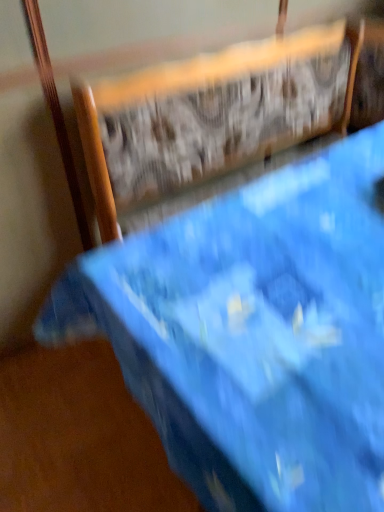
Question: Can you confirm if blue fabric chair at upper center is shorter than blue fabric bed at upper center?

Choices:
 (A) yes
 (B) no

Answer: (B)

Question: From the image's perspective, does blue fabric chair at upper center appear higher than blue fabric bed at upper center?

Choices:
 (A) yes
 (B) no

Answer: (A)

Question: Is the surface of blue fabric chair at upper center in direct contact with blue fabric bed at upper center?

Choices:
 (A) yes
 (B) no

Answer: (B)

Question: Does blue fabric chair at upper center appear on the right side of blue fabric bed at upper center?

Choices:
 (A) yes
 (B) no

Answer: (B)

Question: Is blue fabric chair at upper center facing towards blue fabric bed at upper center?

Choices:
 (A) no
 (B) yes

Answer: (B)

Question: Is blue fabric chair at upper center far away from blue fabric bed at upper center?

Choices:
 (A) yes
 (B) no

Answer: (B)

Question: From a real-world perspective, does blue fabric bed at upper center sit lower than blue fabric chair at upper center?

Choices:
 (A) no
 (B) yes

Answer: (A)

Question: From a real-world perspective, is blue fabric bed at upper center on blue fabric chair at upper center?

Choices:
 (A) yes
 (B) no

Answer: (A)

Question: From the image's perspective, is blue fabric bed at upper center above blue fabric chair at upper center?

Choices:
 (A) yes
 (B) no

Answer: (B)

Question: From the image's perspective, is blue fabric bed at upper center beneath blue fabric chair at upper center?

Choices:
 (A) no
 (B) yes

Answer: (B)

Question: Can you confirm if blue fabric bed at upper center is taller than blue fabric chair at upper center?

Choices:
 (A) no
 (B) yes

Answer: (A)

Question: Is blue fabric bed at upper center located outside blue fabric chair at upper center?

Choices:
 (A) no
 (B) yes

Answer: (A)

Question: From a real-world perspective, is blue fabric chair at upper center above or below blue fabric bed at upper center?

Choices:
 (A) above
 (B) below

Answer: (B)